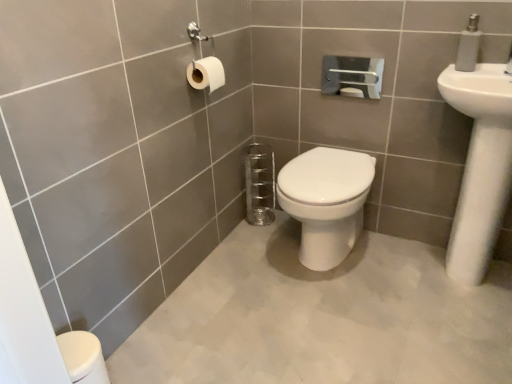
Locate an element on the screen. space that is in front of white glossy toilet at center is located at coordinates (342, 313).